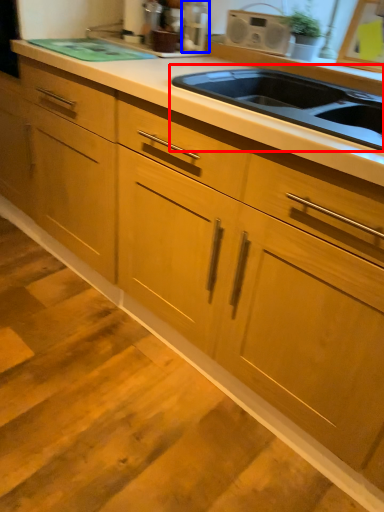
Question: Which point is closer to the camera, sink (highlighted by a red box) or appliance (highlighted by a blue box)?

Choices:
 (A) sink
 (B) appliance

Answer: (A)